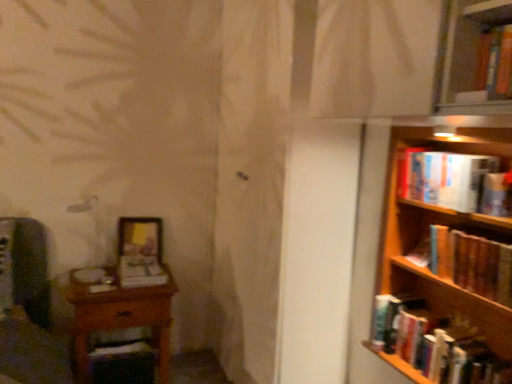
Question: From the image's perspective, is matte white book at center, which appears as the second book when ordered from the bottom, over wooden table at left?

Choices:
 (A) yes
 (B) no

Answer: (A)

Question: Is matte white book at center, which is the first book in left-to-right order, not near wooden table at left?

Choices:
 (A) yes
 (B) no

Answer: (B)

Question: Is matte white book at center, which is the first book in left-to-right order, placed right next to wooden table at left?

Choices:
 (A) yes
 (B) no

Answer: (B)

Question: From a real-world perspective, is matte white book at center, which is the first book in left-to-right order, positioned under wooden table at left based on gravity?

Choices:
 (A) yes
 (B) no

Answer: (B)

Question: Is matte white book at center, the 3th book from the top, turned away from wooden table at left?

Choices:
 (A) no
 (B) yes

Answer: (A)

Question: Is matte white book at center, which is the first book in left-to-right order, smaller than wooden table at left?

Choices:
 (A) no
 (B) yes

Answer: (B)

Question: Could you tell me if wooden table at left is turned towards wooden frame at lower left?

Choices:
 (A) no
 (B) yes

Answer: (A)

Question: From the image's perspective, does wooden table at left appear higher than wooden frame at lower left?

Choices:
 (A) no
 (B) yes

Answer: (A)

Question: Is wooden table at left at the right side of wooden frame at lower left?

Choices:
 (A) yes
 (B) no

Answer: (B)

Question: Are wooden table at left and wooden frame at lower left located far from each other?

Choices:
 (A) yes
 (B) no

Answer: (B)

Question: Is wooden table at left at the left side of wooden frame at lower left?

Choices:
 (A) no
 (B) yes

Answer: (B)

Question: Considering the relative sizes of wooden table at left and wooden frame at lower left in the image provided, is wooden table at left bigger than wooden frame at lower left?

Choices:
 (A) yes
 (B) no

Answer: (A)

Question: Does hardcover book at right, which is the second book in top-to-bottom order, have a larger size compared to hardcover book at right, placed as the 2th book when sorted from right to left?

Choices:
 (A) no
 (B) yes

Answer: (A)